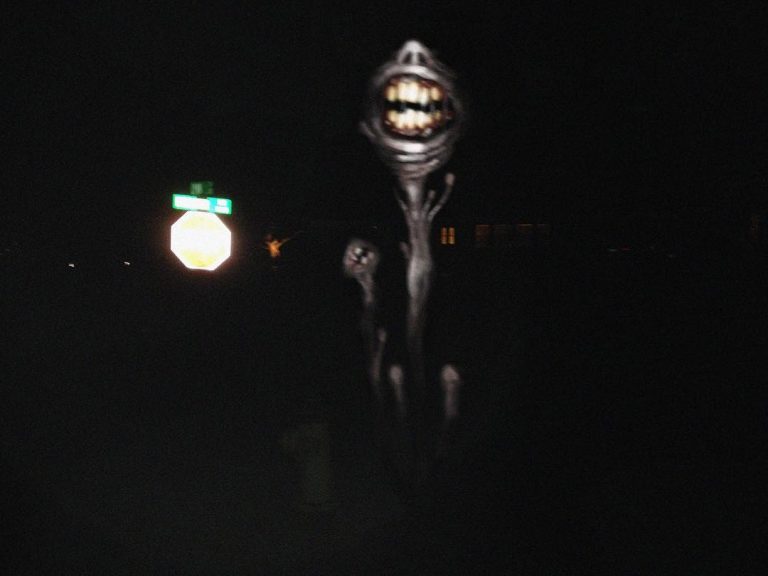
In order to click on window in this screenshot , I will do `click(449, 234)`.